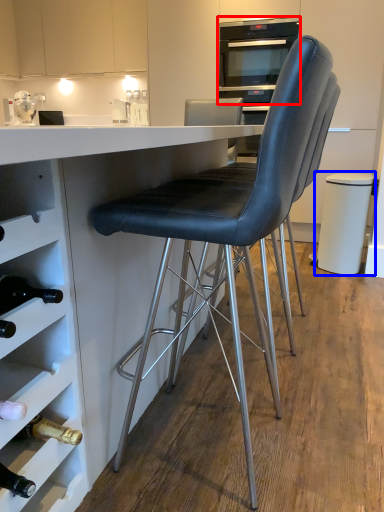
Question: Which object is closer to the camera taking this photo, home appliance (highlighted by a red box) or bar stool (highlighted by a blue box)?

Choices:
 (A) home appliance
 (B) bar stool

Answer: (B)